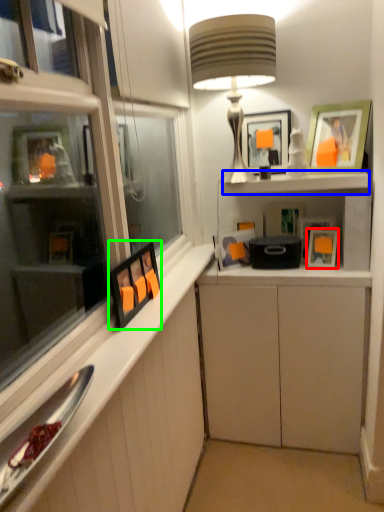
Question: Based on their relative distances, which object is nearer to picture frame (highlighted by a red box)? Choose from cabinet (highlighted by a blue box) and picture frame (highlighted by a green box).

Choices:
 (A) cabinet
 (B) picture frame

Answer: (A)